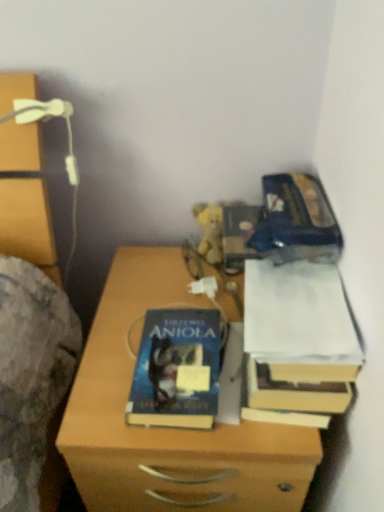
You are a GUI agent. You are given a task and a screenshot of the screen. Output one action in this format:
    pyautogui.click(x=<x>, y=<y>)
    Task: Click on the free spot above wooden nightstand at center (from a real-world perspective)
    
    Given the screenshot: What is the action you would take?
    pyautogui.click(x=172, y=305)